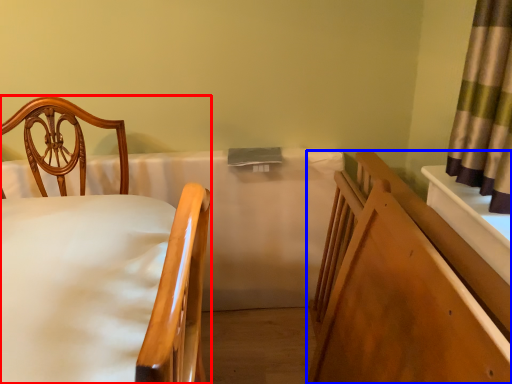
Question: Which object appears closest to the camera in this image, chair (highlighted by a red box) or bed frame (highlighted by a blue box)?

Choices:
 (A) chair
 (B) bed frame

Answer: (A)